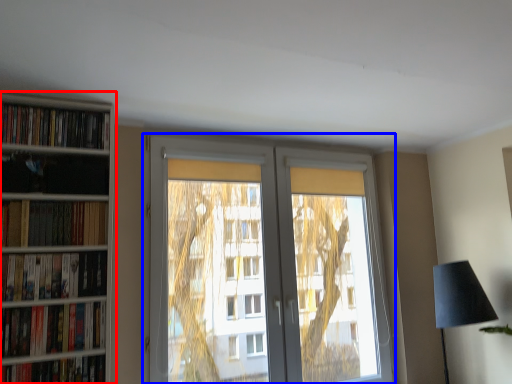
Question: Which of the following is the farthest to the observer, bookcase (highlighted by a red box) or window (highlighted by a blue box)?

Choices:
 (A) bookcase
 (B) window

Answer: (B)